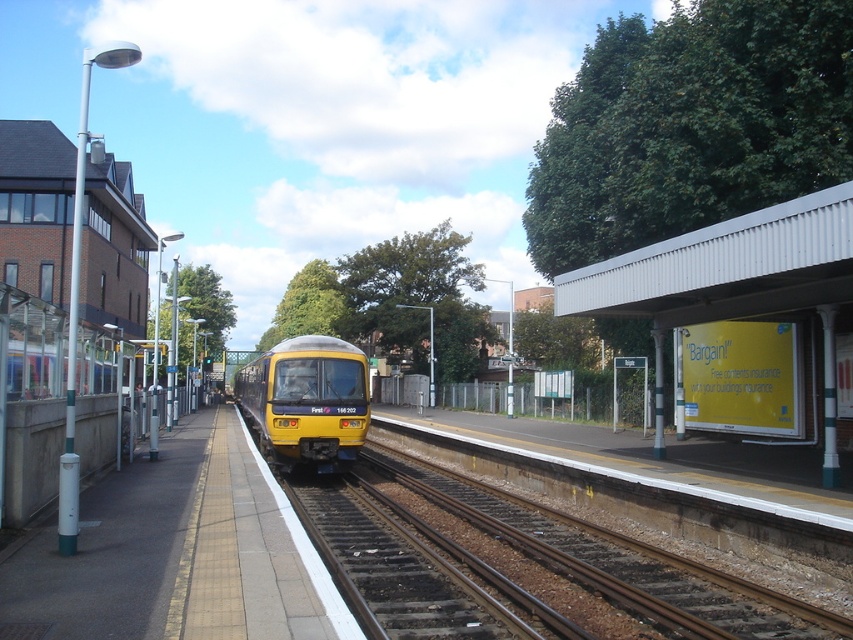
Question: Based on their relative distances, which object is nearer to the brown metal track at center?

Choices:
 (A) smooth concrete platform at center
 (B) yellow matte train at center

Answer: (A)

Question: Can you confirm if brown metal track at center is positioned below yellow matte train at center?

Choices:
 (A) yes
 (B) no

Answer: (A)

Question: Is smooth concrete platform at center positioned before brown metal track at center?

Choices:
 (A) no
 (B) yes

Answer: (B)

Question: Which object is positioned farthest from the yellow matte train at center?

Choices:
 (A) smooth concrete platform at center
 (B) brown metal track at center

Answer: (B)

Question: Which of these objects is positioned farthest from the yellow matte train at center?

Choices:
 (A) brown metal track at center
 (B) smooth concrete platform at center

Answer: (A)

Question: Is brown metal track at center wider than yellow matte train at center?

Choices:
 (A) yes
 (B) no

Answer: (B)